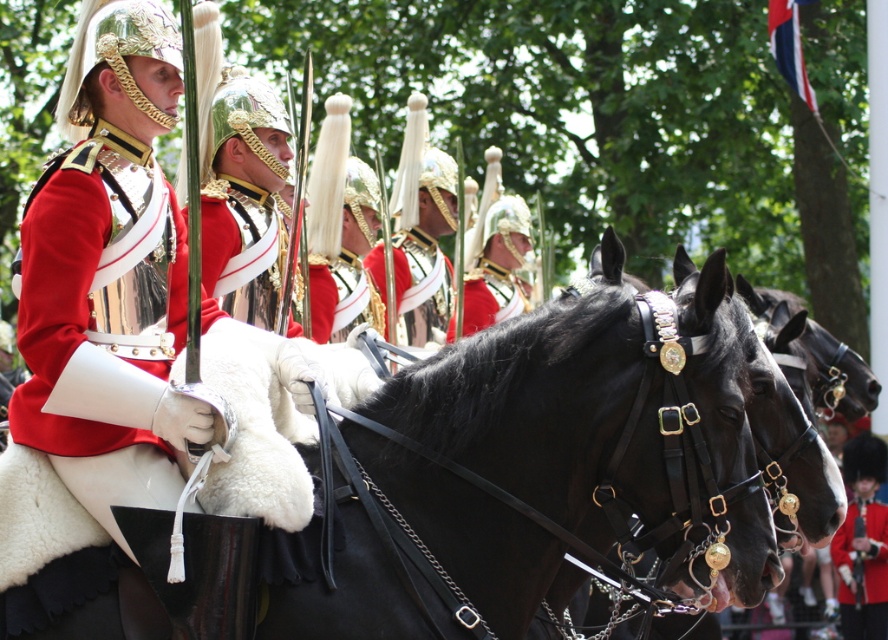
You are a photographer at the ceremony and want to capture the shiny red fabric at center and the shiny gold helmet at center in a single shot. Which object should you focus on first to ensure both are in the frame?

The shiny red fabric at center is above the shiny gold helmet at center, so you should focus on the shiny gold helmet at center first to ensure both are in the frame.

Consider the image. You are a photographer trying to capture the ceremonial guards. You notice the shiny red fabric at center and the metallic silver helmet at center in your frame. Which object should you focus on if you want to highlight something closer to the ground?

The shiny red fabric at center has a lesser height compared to the metallic silver helmet at center, so focusing on the shiny red fabric at center would highlight something closer to the ground.